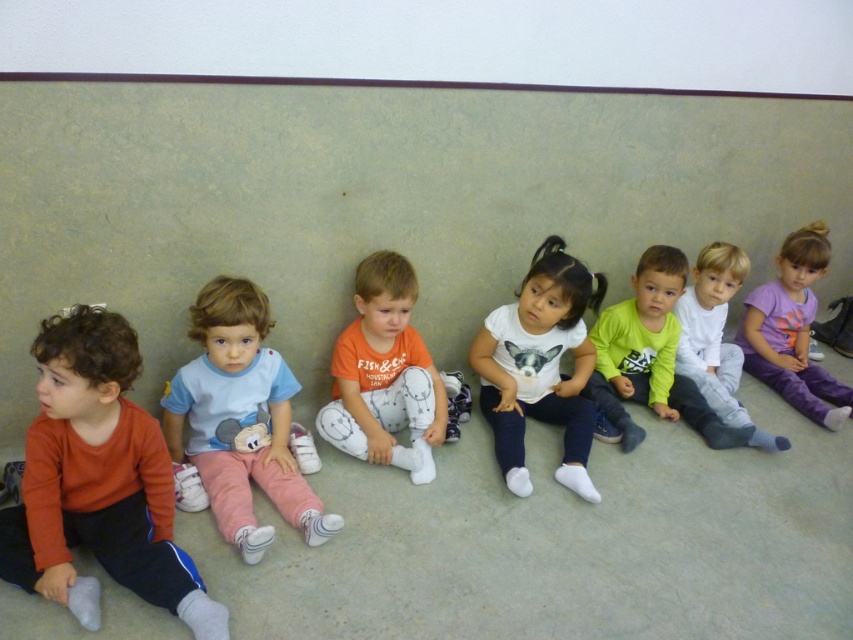
You are standing in front of the wall where the children are sitting. There are two points marked on the wall at coordinates point (421,384) and point (621,424). Which point is closer to you?

Point (421,384) is closer to the viewer than point (621,424).

You are a teacher observing the children sitting on the floor. Which child is positioned closer to you between the orange cotton shirt at center and the purple cotton shirt at right?

The orange cotton shirt at center is positioned closer to you than the purple cotton shirt at right.